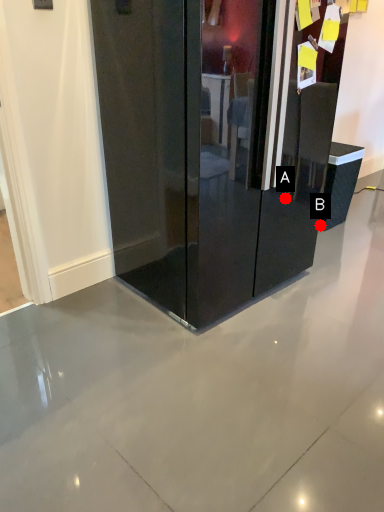
Question: Two points are circled on the image, labeled by A and B beside each circle. Among these points, which one is farthest from the camera?

Choices:
 (A) A is further
 (B) B is further

Answer: (B)